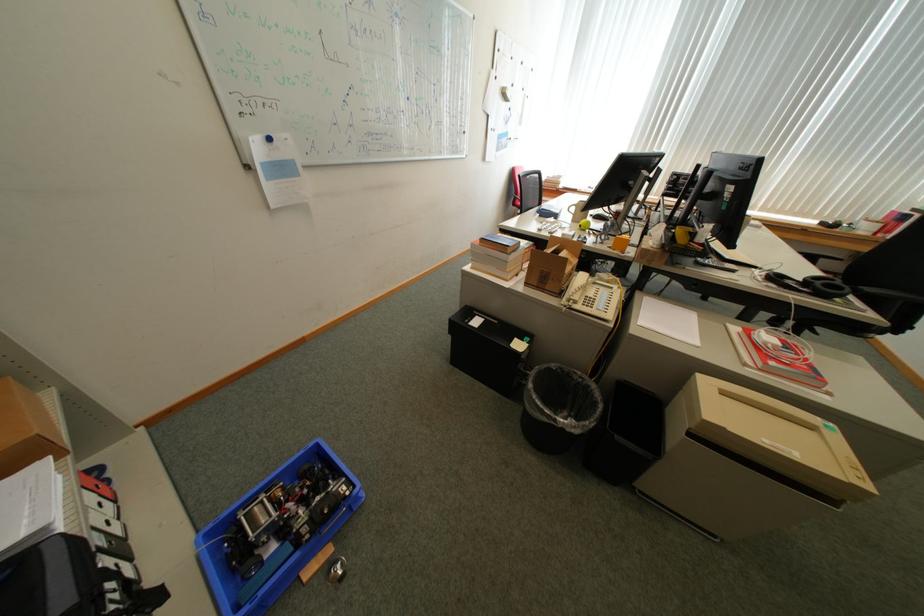
Where would you pull the white binder spine? Please return your answer as a coordinate pair (x, y).

(783, 344)